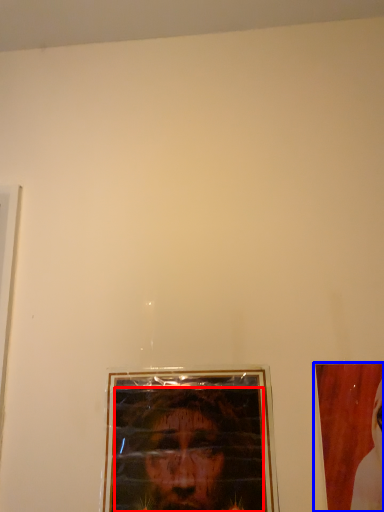
Question: Which object is further to the camera taking this photo, man (highlighted by a red box) or picture frame (highlighted by a blue box)?

Choices:
 (A) man
 (B) picture frame

Answer: (A)